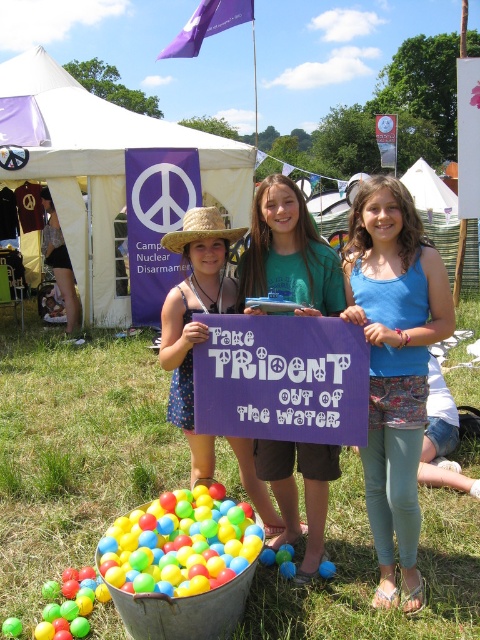
Question: Is multicolored plastic balls at lower left smaller than polka dot dress at center?

Choices:
 (A) no
 (B) yes

Answer: (B)

Question: Is multicolored plastic balls at lower left thinner than strawmaterial/texturehat at center?

Choices:
 (A) yes
 (B) no

Answer: (B)

Question: Which of the following is the closest to the observer?

Choices:
 (A) (173, 250)
 (B) (298, 202)
 (C) (151, 593)

Answer: (C)

Question: Based on their relative distances, which object is nearer to the blue denim shorts at lower center?

Choices:
 (A) matte purple sign at center
 (B) strawmaterial/texturehat at center
 (C) multicolored plastic balls at lower left

Answer: (A)

Question: Which of these objects is positioned farthest from the polka dot dress at center?

Choices:
 (A) strawmaterial/texturehat at center
 (B) matte purple sign at center
 (C) multicolored plastic balls at lower left
 (D) blue denim shorts at lower center

Answer: (D)

Question: Is polka dot dress at center wider than strawmaterial/texturehat at center?

Choices:
 (A) yes
 (B) no

Answer: (A)